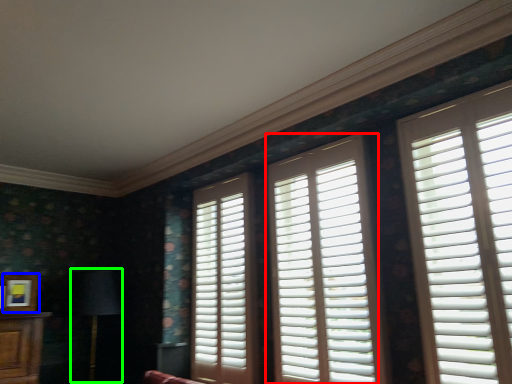
Question: Based on their relative distances, which object is farther from window (highlighted by a red box)? Choose from picture frame (highlighted by a blue box) and table lamp (highlighted by a green box).

Choices:
 (A) picture frame
 (B) table lamp

Answer: (A)